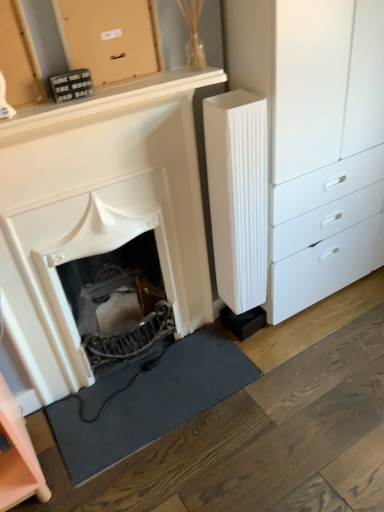
Question: Does white matte fireplace at center have a greater height compared to black rubber doormat at lower left?

Choices:
 (A) no
 (B) yes

Answer: (B)

Question: Is white matte fireplace at center shorter than black rubber doormat at lower left?

Choices:
 (A) no
 (B) yes

Answer: (A)

Question: Does white matte fireplace at center come in front of black rubber doormat at lower left?

Choices:
 (A) no
 (B) yes

Answer: (B)

Question: Is white matte fireplace at center beside black rubber doormat at lower left?

Choices:
 (A) yes
 (B) no

Answer: (B)

Question: Does white matte fireplace at center come behind black rubber doormat at lower left?

Choices:
 (A) no
 (B) yes

Answer: (A)

Question: In terms of height, does pink matte cabinet at lower left, the second cabinetry in the right-to-left sequence, look taller or shorter compared to white ribbed radiator at right?

Choices:
 (A) short
 (B) tall

Answer: (A)

Question: Looking at their shapes, would you say pink matte cabinet at lower left, arranged as the second cabinetry when viewed from the top, is wider or thinner than white ribbed radiator at right?

Choices:
 (A) wide
 (B) thin

Answer: (A)

Question: From the image's perspective, is pink matte cabinet at lower left, the first cabinetry in the left-to-right sequence, above or below white ribbed radiator at right?

Choices:
 (A) below
 (B) above

Answer: (A)

Question: Is pink matte cabinet at lower left, arranged as the second cabinetry when viewed from the top, inside or outside of white ribbed radiator at right?

Choices:
 (A) outside
 (B) inside

Answer: (A)

Question: In terms of height, does wooden board at upper center, which is the 1th cabinetry in right-to-left order, look taller or shorter compared to pink matte cabinet at lower left, which is the 1th cabinetry from bottom to top?

Choices:
 (A) short
 (B) tall

Answer: (A)

Question: Which is correct: wooden board at upper center, placed as the 2th cabinetry when sorted from bottom to top, is inside pink matte cabinet at lower left, the second cabinetry in the right-to-left sequence, or outside of it?

Choices:
 (A) inside
 (B) outside

Answer: (B)

Question: Is wooden board at upper center, which is counted as the second cabinetry, starting from the left, bigger or smaller than pink matte cabinet at lower left, arranged as the second cabinetry when viewed from the top?

Choices:
 (A) big
 (B) small

Answer: (B)

Question: In the image, is wooden board at upper center, which is counted as the second cabinetry, starting from the left, on the left side or the right side of pink matte cabinet at lower left, the second cabinetry in the right-to-left sequence?

Choices:
 (A) left
 (B) right

Answer: (B)

Question: Is wooden board at upper center, placed as the 2th cabinetry when sorted from bottom to top, inside or outside of white matte fireplace at center?

Choices:
 (A) inside
 (B) outside

Answer: (B)

Question: In the image, is wooden board at upper center, which is counted as the second cabinetry, starting from the left, positioned in front of or behind white matte fireplace at center?

Choices:
 (A) front
 (B) behind

Answer: (B)